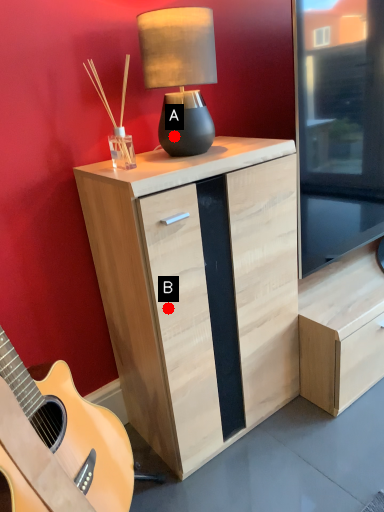
Question: Two points are circled on the image, labeled by A and B beside each circle. Which point appears closest to the camera in this image?

Choices:
 (A) A is closer
 (B) B is closer

Answer: (B)